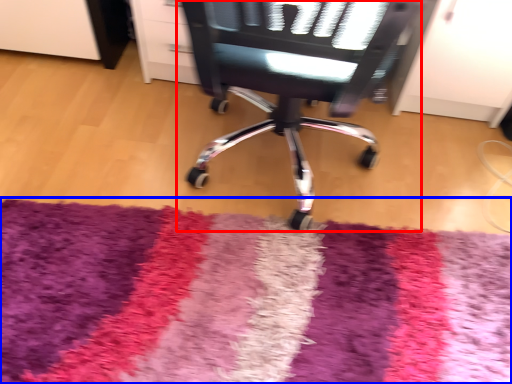
Question: Which object is closer to the camera taking this photo, chair (highlighted by a red box) or mat (highlighted by a blue box)?

Choices:
 (A) chair
 (B) mat

Answer: (A)